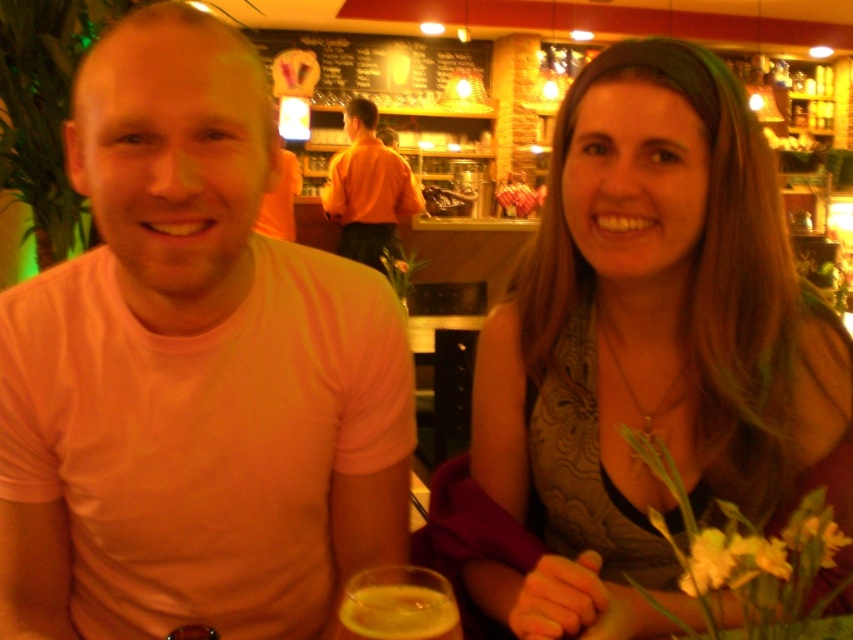
You are a fashion designer observing two shirts displayed at a central table in a cafe scene. The shirts are labeled as the pink cotton shirt at center and the orange shirt at center. Based on their sizes, which one would you recommend for a client who prefers a more compact and fitted style?

The pink cotton shirt at center has a smaller size compared to the orange shirt at center, so it would be the better recommendation for a client seeking a more compact and fitted style.

You are a photographer standing at the camera position. You want to place a small decorative item exactly 80 centimeters away from your current position. The scene has a point at coordinates point (671, 232). Can you use this point as the location for the decorative item?

The point (671, 232) is 79.90 centimeters from the camera, so yes, you can use this point as the location for the decorative item since it is very close to the desired 80 centimeter distance.